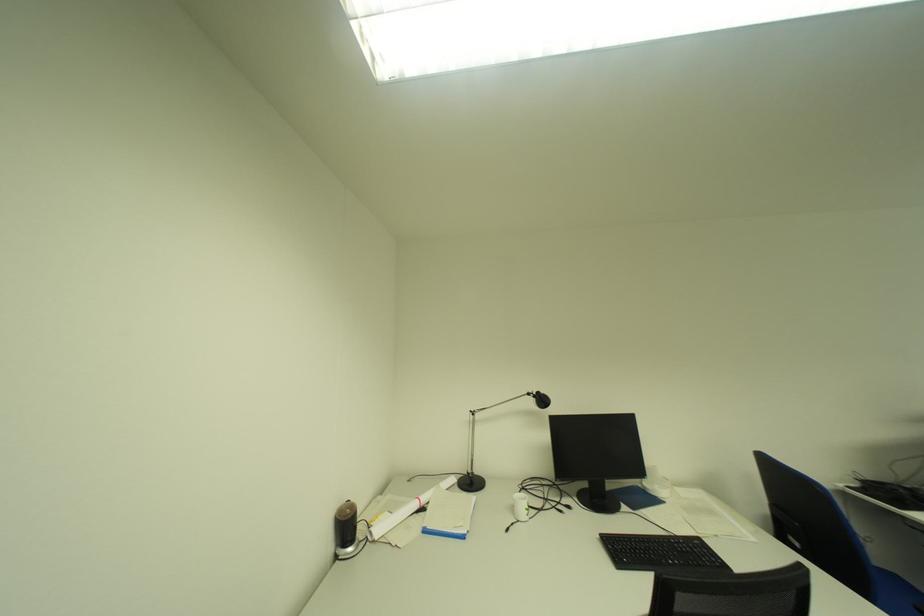
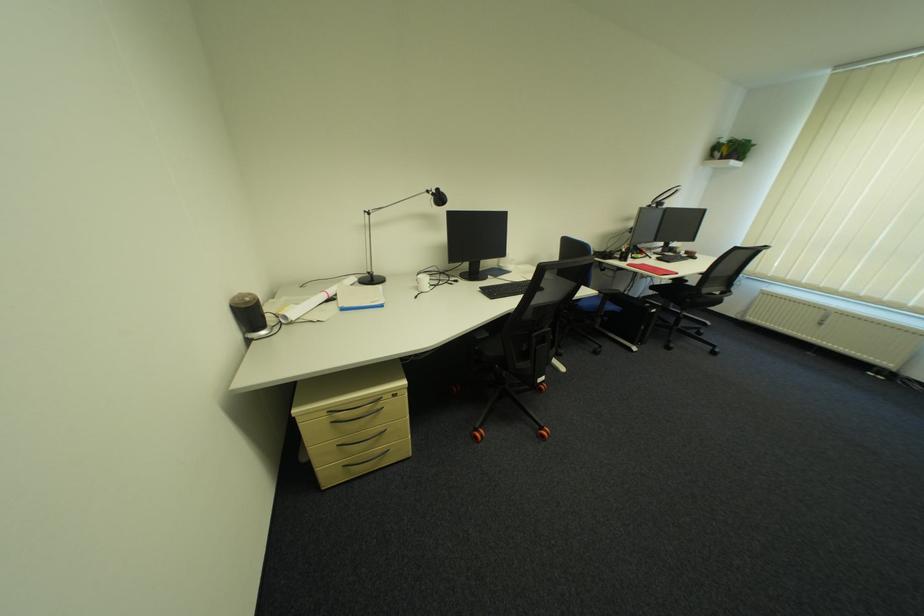
In the second image, find the point that corresponds to (544,394) in the first image.

(444, 192)